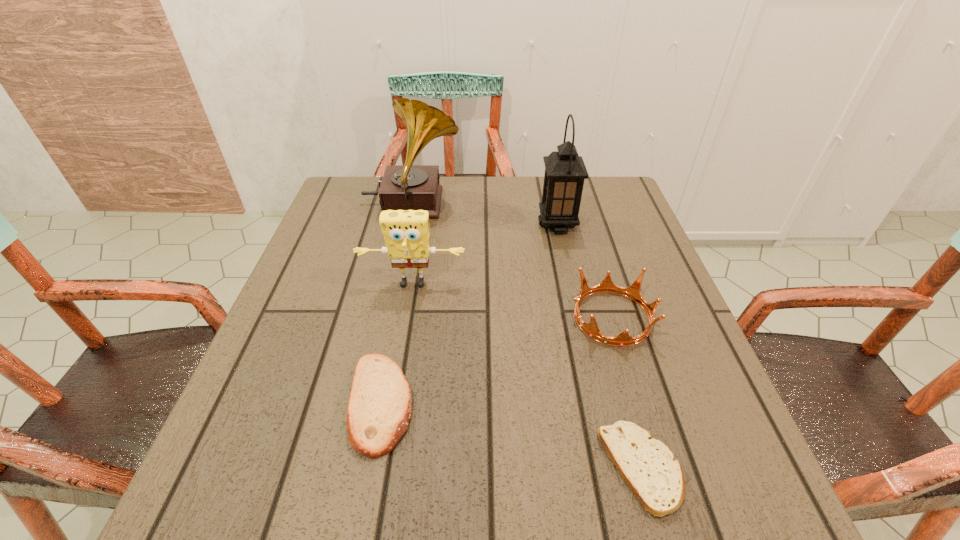
Where is `phonograph record`? The height and width of the screenshot is (540, 960). phonograph record is located at coordinates (404, 187).

I want to click on lantern, so click(x=565, y=171).

Where is `sponge`? sponge is located at coordinates (406, 232).

Find the location of a particular element. The height and width of the screenshot is (540, 960). crown is located at coordinates (633, 292).

Locate an element on the screen. The height and width of the screenshot is (540, 960). the left pita bread is located at coordinates (379, 409).

Identify the location of the taller pita bread. The height and width of the screenshot is (540, 960). (379, 409).

At what (x,y) coordinates should I click in order to perform the action: click on the shorter pita bread. Please return your answer as a coordinate pair (x, y). The image size is (960, 540). Looking at the image, I should click on (648, 466).

Find the location of a particular element. This screenshot has height=540, width=960. the right pita bread is located at coordinates (648, 466).

Identify the location of free region located 0.240m from the horn of the phonograph record. (549, 204).

The height and width of the screenshot is (540, 960). Find the location of `vacant space located 0.060m on the back of the lantern`. vacant space located 0.060m on the back of the lantern is located at coordinates (552, 201).